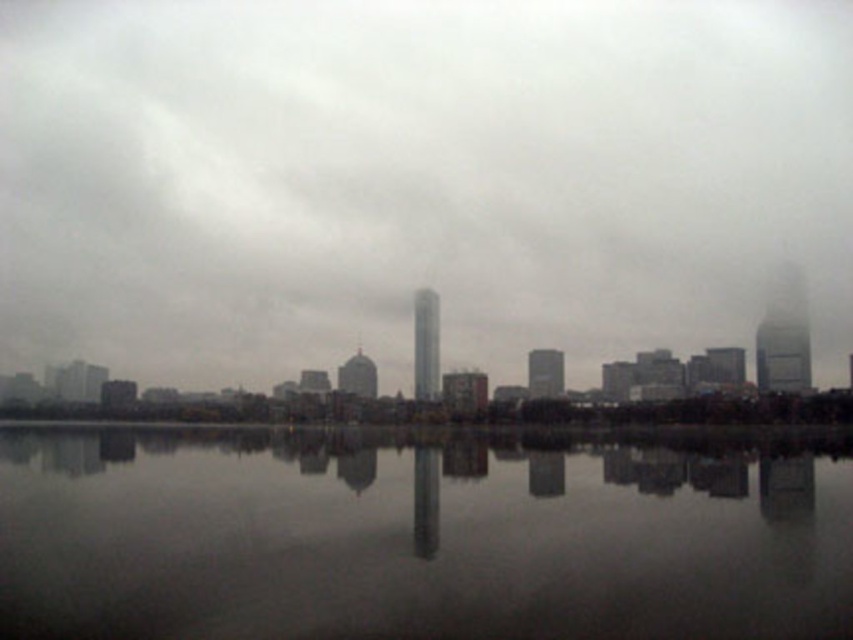
The height and width of the screenshot is (640, 853). I want to click on gray foggy sky at center, so coord(416,179).

Is point (0, 113) positioned after point (527, 608)?

Yes.

At what (x,y) coordinates should I click in order to perform the action: click on gray foggy sky at center. Please return your answer as a coordinate pair (x, y). Looking at the image, I should click on (416, 179).